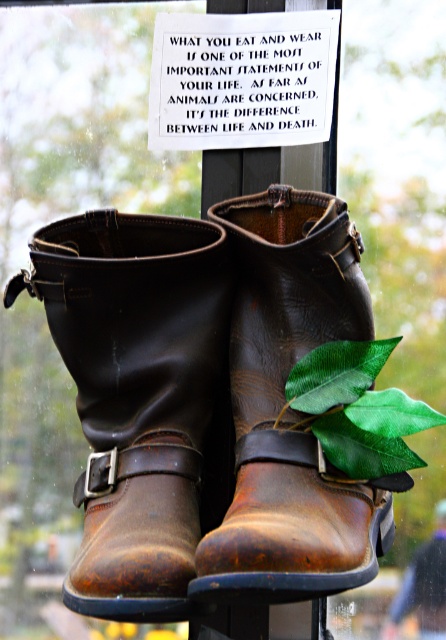
You are a photographer trying to capture the brown leather cowboy boot at center. The camera is set to focus at point 0.616, 0.305. Will the boot be in focus?

Yes, the brown leather cowboy boot at center is exactly at point (136, 394), so it will be in focus.